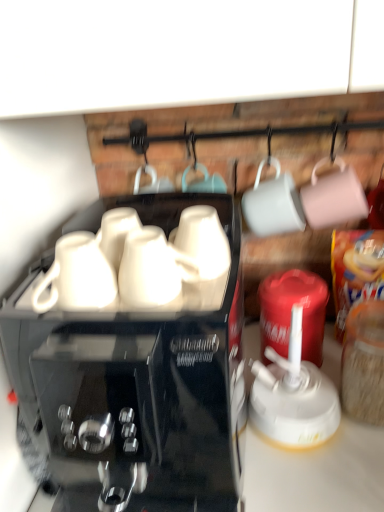
Question: From a real-world perspective, is black glossy coffee maker at center positioned over white glossy mug at center, which appears as the first mug when viewed from the left, based on gravity?

Choices:
 (A) no
 (B) yes

Answer: (A)

Question: Is the depth of black glossy coffee maker at center less than that of white glossy mug at center, which appears as the first mug when viewed from the left?

Choices:
 (A) yes
 (B) no

Answer: (A)

Question: Does black glossy coffee maker at center have a greater width compared to white glossy mug at center, which is counted as the second mug, starting from the right?

Choices:
 (A) yes
 (B) no

Answer: (A)

Question: Considering the relative sizes of black glossy coffee maker at center and white glossy mug at center, which appears as the first mug when viewed from the left, in the image provided, is black glossy coffee maker at center thinner than white glossy mug at center, which appears as the first mug when viewed from the left,?

Choices:
 (A) yes
 (B) no

Answer: (B)

Question: Is black glossy coffee maker at center in contact with white glossy mug at center, which appears as the first mug when viewed from the left?

Choices:
 (A) yes
 (B) no

Answer: (B)

Question: Considering the relative sizes of black glossy coffee maker at center and white glossy mug at center, which is counted as the second mug, starting from the right, in the image provided, is black glossy coffee maker at center shorter than white glossy mug at center, which is counted as the second mug, starting from the right,?

Choices:
 (A) yes
 (B) no

Answer: (B)

Question: Does white glossy mug at center, which is counted as the second mug, starting from the right, have a larger size compared to black glossy coffee maker at center?

Choices:
 (A) yes
 (B) no

Answer: (B)

Question: Is white glossy mug at center, which is counted as the second mug, starting from the right, thinner than black glossy coffee maker at center?

Choices:
 (A) no
 (B) yes

Answer: (B)

Question: From a real-world perspective, is white glossy mug at center, which is counted as the second mug, starting from the right, beneath black glossy coffee maker at center?

Choices:
 (A) no
 (B) yes

Answer: (A)

Question: From the image's perspective, is white glossy mug at center, which appears as the first mug when viewed from the left, on top of black glossy coffee maker at center?

Choices:
 (A) no
 (B) yes

Answer: (B)

Question: Is white glossy mug at center, which appears as the first mug when viewed from the left, closer to camera compared to black glossy coffee maker at center?

Choices:
 (A) no
 (B) yes

Answer: (A)

Question: Is white glossy mug at center, which appears as the first mug when viewed from the left, at the right side of black glossy coffee maker at center?

Choices:
 (A) yes
 (B) no

Answer: (A)

Question: Is the surface of white glossy mug at center, which is counted as the second mug, starting from the right, in direct contact with white glossy mug at center, the first mug in the right-to-left sequence?

Choices:
 (A) no
 (B) yes

Answer: (B)